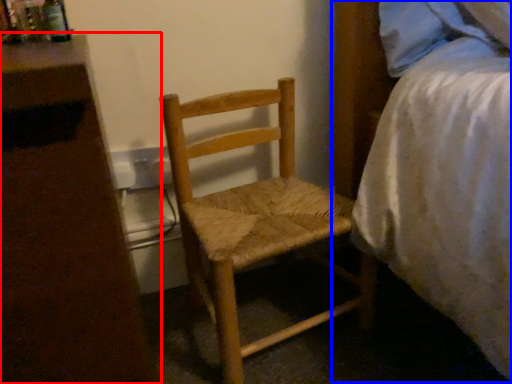
Question: Which point is further to the camera, nightstand (highlighted by a red box) or bed (highlighted by a blue box)?

Choices:
 (A) nightstand
 (B) bed

Answer: (B)